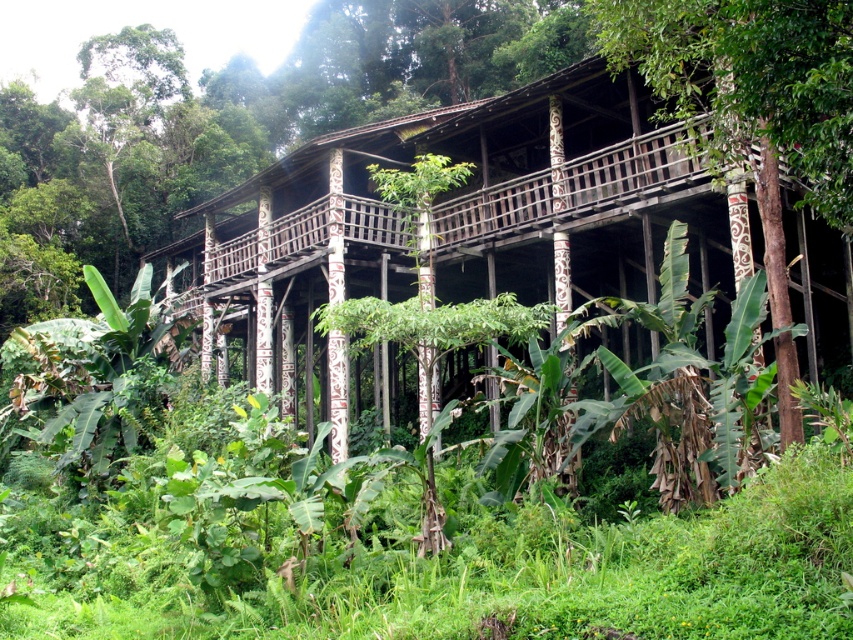
Question: Which object is farther from the camera taking this photo?

Choices:
 (A) brown wood pole at center
 (B) wooden hut at center

Answer: (B)

Question: Which object appears closest to the camera in this image?

Choices:
 (A) brown wood pole at center
 (B) wooden hut at center

Answer: (A)

Question: From the image, what is the correct spatial relationship of wooden hut at center in relation to brown wood pole at center?

Choices:
 (A) above
 (B) below

Answer: (B)

Question: In this image, where is wooden hut at center located relative to brown wood pole at center?

Choices:
 (A) below
 (B) above

Answer: (A)

Question: Does wooden hut at center appear under brown wood pole at center?

Choices:
 (A) yes
 (B) no

Answer: (A)